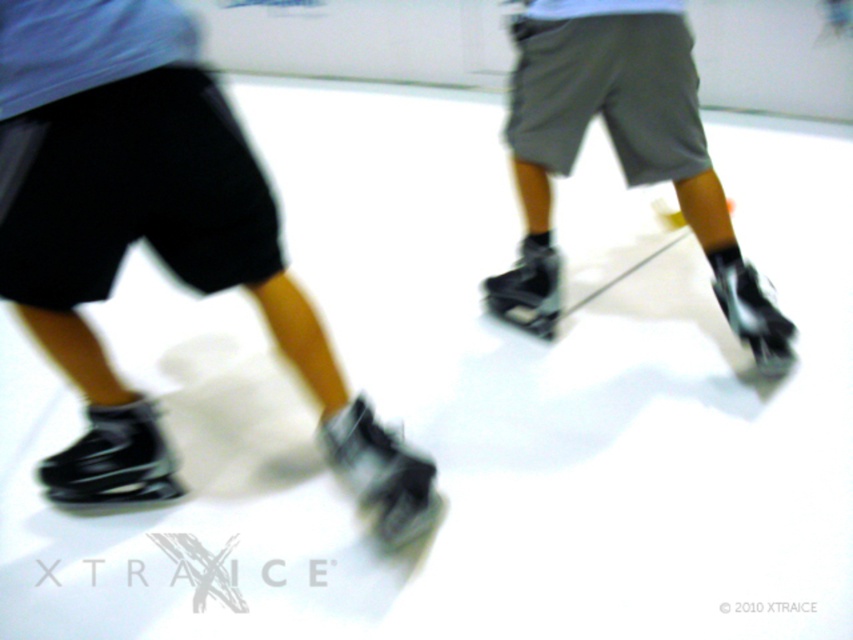
You are designing a storage rack for ice skates and roller skates. You have two items in front of you, the matte black skate shoes at center and the black matte roller skate at center. Based on their widths, can you determine which one requires a wider slot in the rack?

The matte black skate shoes at center might be wider than black matte roller skate at center, so the slot for the matte black skate shoes at center should be wider to accommodate its width.

You are standing on the ice rink and see the point marked at coordinates (621, 147). What object is located at that point?

The point at coordinates (621, 147) corresponds to the matte black skate shoes at center.

You are a skate shop employee and a customer asks if the matte black skate shoes at center can be worn over the black matte roller skate at center. Based on the image, how would you respond?

The matte black skate shoes at center are positioned over the black matte roller skate at center in the image, so they can be worn together.